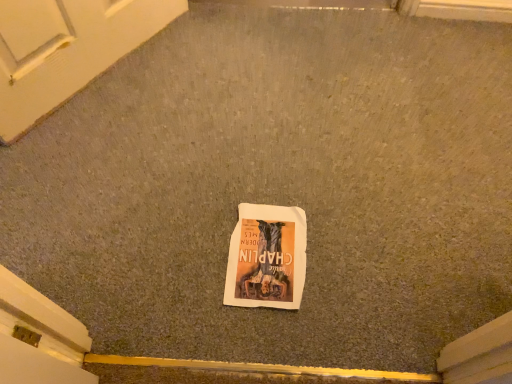
Where is `free space on the front side of white paper at center`? The height and width of the screenshot is (384, 512). free space on the front side of white paper at center is located at coordinates (272, 328).